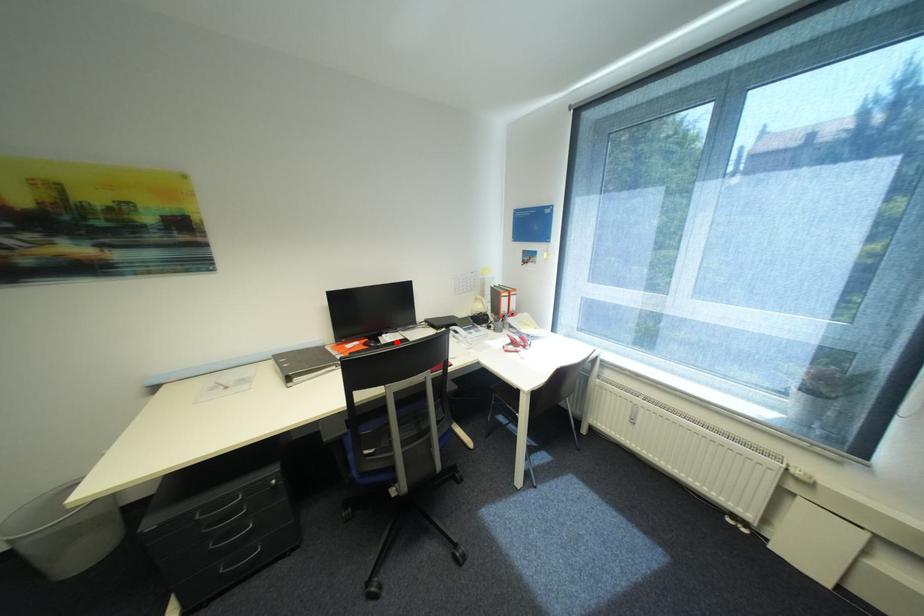
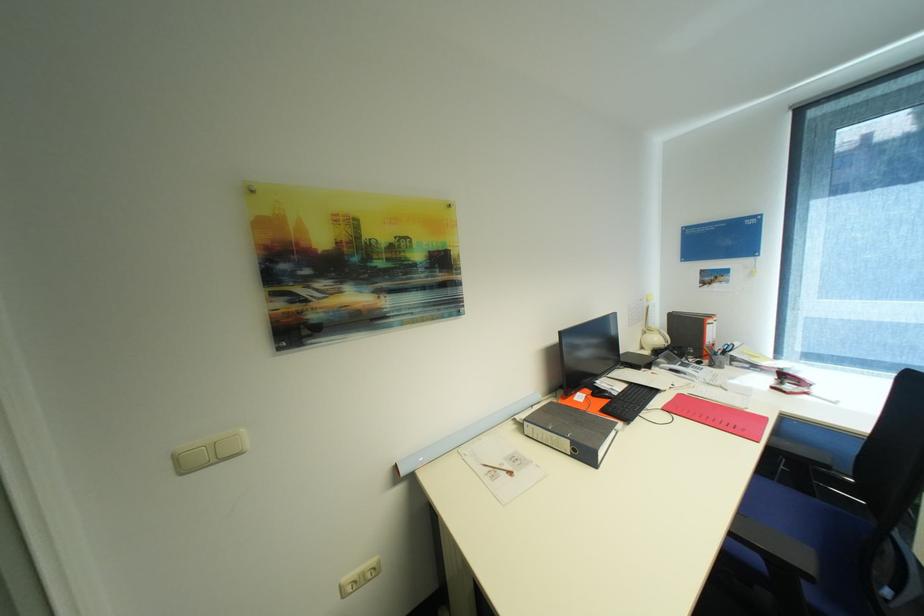
The point at the highlighted location is marked in the first image. Where is the corresponding point in the second image?

(627, 391)